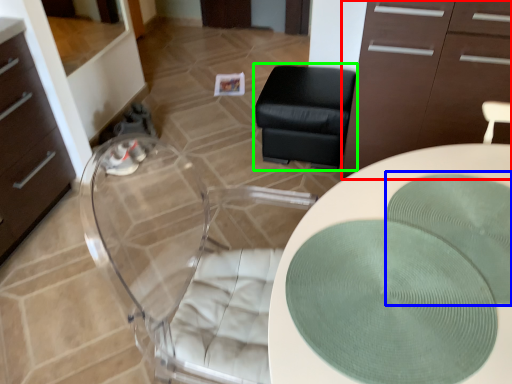
Question: Based on their relative distances, which object is nearer to cabinetry (highlighted by a red box)? Choose from mat (highlighted by a blue box) and furniture (highlighted by a green box).

Choices:
 (A) mat
 (B) furniture

Answer: (B)